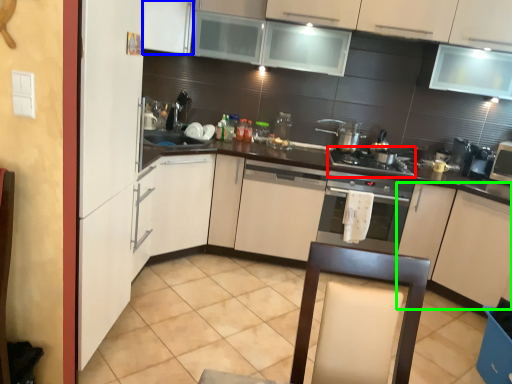
Question: Estimate the real-world distances between objects in this image. Which object is farther from gas stove (highlighted by a red box), cabinetry (highlighted by a blue box) or cabinetry (highlighted by a green box)?

Choices:
 (A) cabinetry
 (B) cabinetry

Answer: (A)